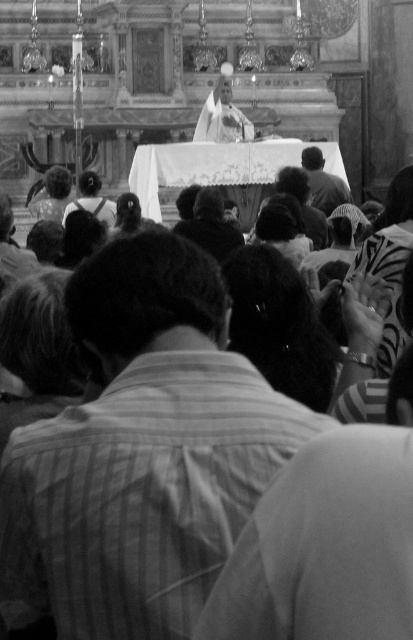
Question: Which point is farther to the camera?

Choices:
 (A) dark hair at upper center
 (B) striped fabric shirt at center

Answer: (A)

Question: Does striped fabric shirt at center appear on the left side of dark hair at upper center?

Choices:
 (A) no
 (B) yes

Answer: (B)

Question: Is striped fabric shirt at center to the left of dark hair at upper center from the viewer's perspective?

Choices:
 (A) no
 (B) yes

Answer: (B)

Question: Can you confirm if striped fabric shirt at center is thinner than dark hair at upper center?

Choices:
 (A) no
 (B) yes

Answer: (A)

Question: Which of the following is the farthest from the observer?

Choices:
 (A) striped fabric shirt at center
 (B) dark hair at upper center

Answer: (B)